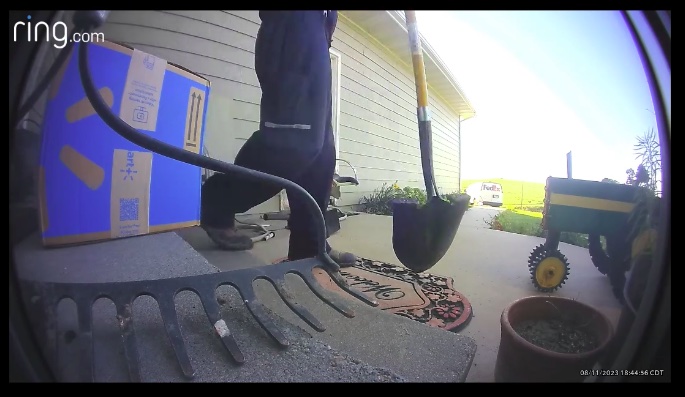
Find the location of a particular element. This screenshot has width=685, height=397. plant pot is located at coordinates (564, 342).